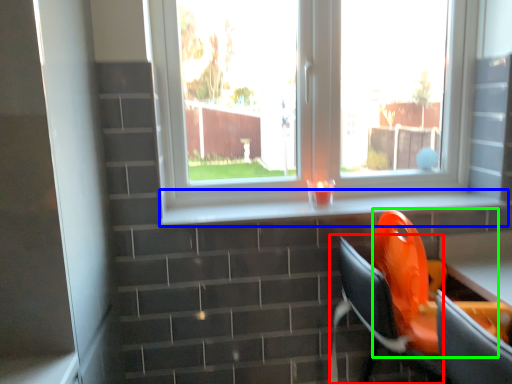
Question: Estimate the real-world distances between objects in this image. Which object is closer to computer chair (highlighted by a red box), window sill (highlighted by a blue box) or swivel chair (highlighted by a green box)?

Choices:
 (A) window sill
 (B) swivel chair

Answer: (B)